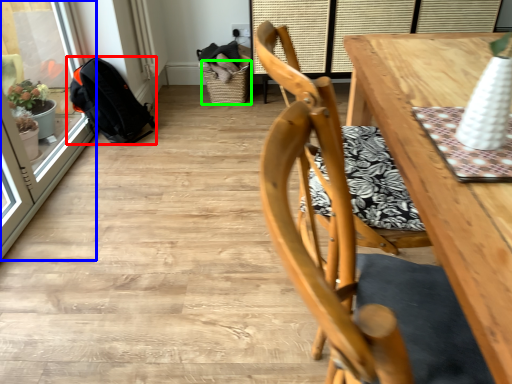
Question: Based on their relative distances, which object is nearer to backpack (highlighted by a red box)? Choose from screen door (highlighted by a blue box) and basket (highlighted by a green box).

Choices:
 (A) screen door
 (B) basket

Answer: (A)